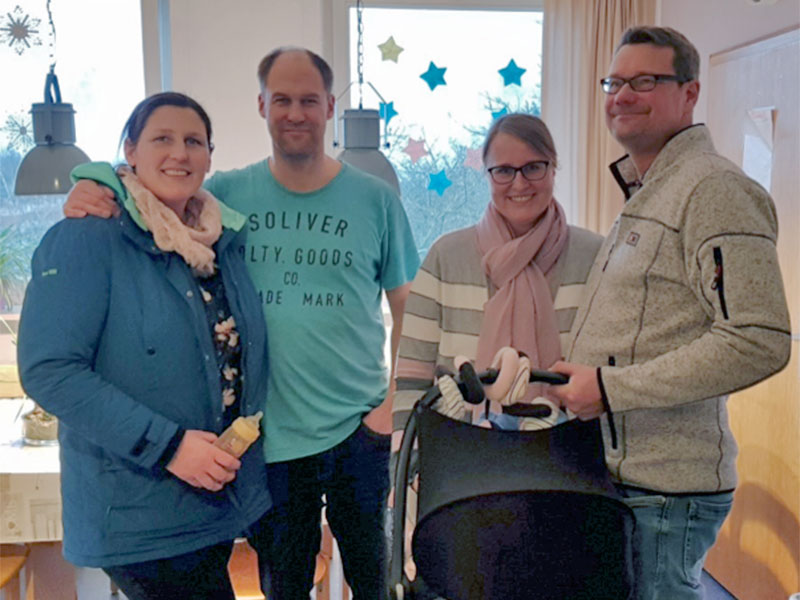
Find the location of `paper on wall`. paper on wall is located at coordinates (761, 127).